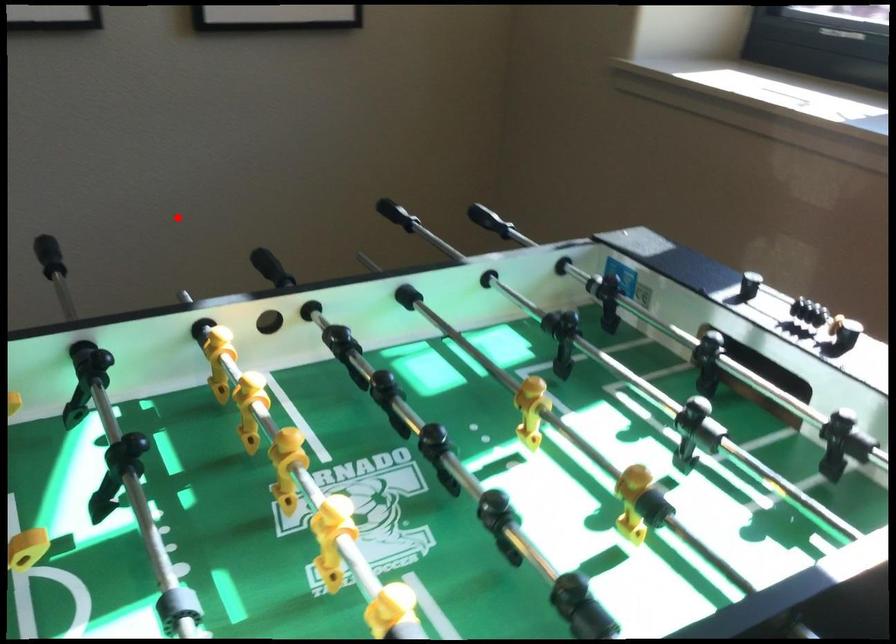
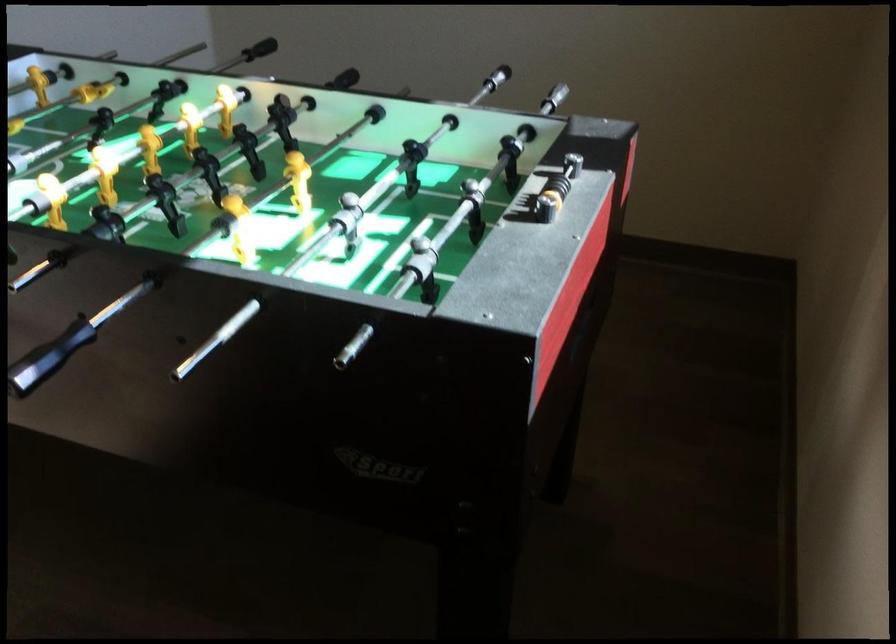
Find the pixel in the second image that matches the highlighted location in the first image.

(496, 78)